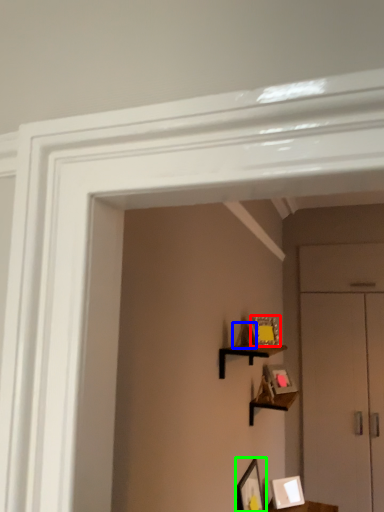
Question: Which object is positioned farthest from picture frame (highlighted by a red box)? Select from picture frame (highlighted by a blue box) and picture frame (highlighted by a green box).

Choices:
 (A) picture frame
 (B) picture frame

Answer: (B)